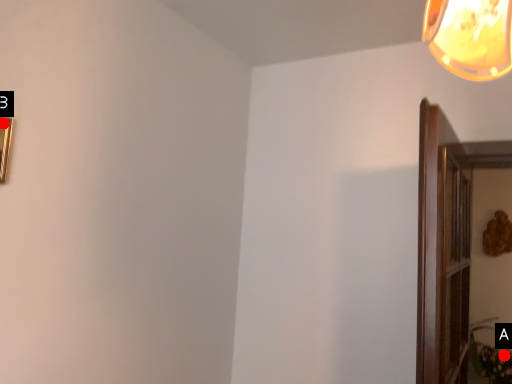
Question: Two points are circled on the image, labeled by A and B beside each circle. Which point appears closest to the camera in this image?

Choices:
 (A) A is closer
 (B) B is closer

Answer: (B)